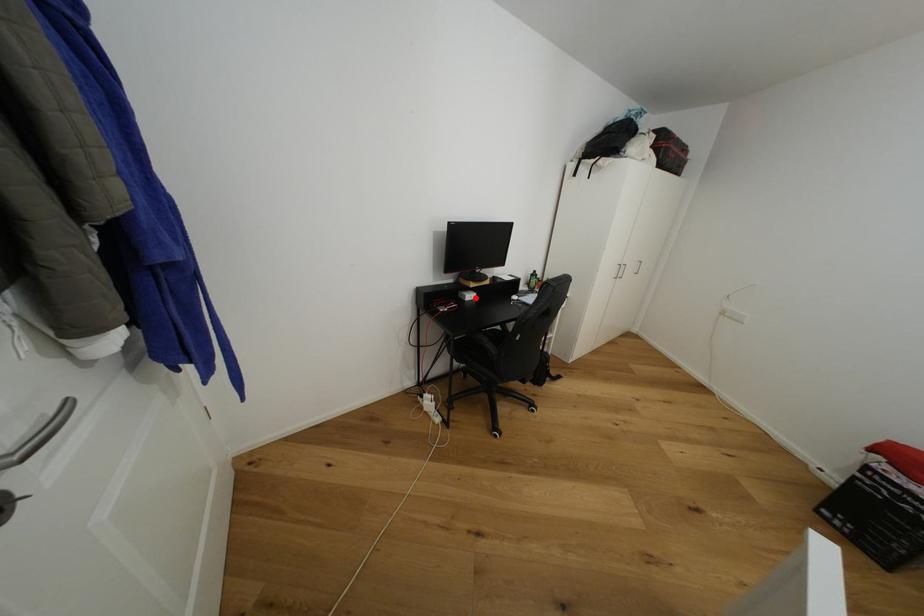
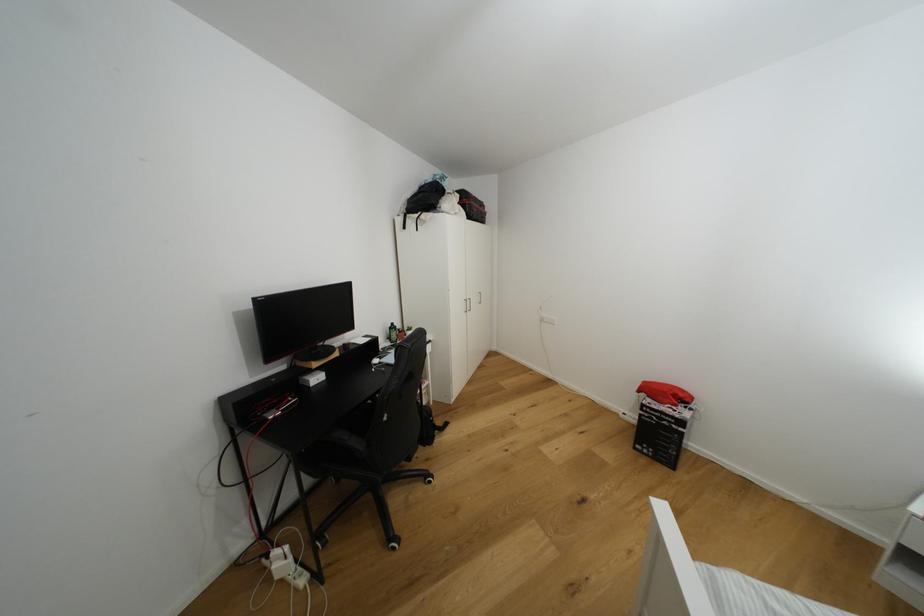
Question: I am providing you with two images of the same scene from different viewpoints. Given a red point in image1, look at the same physical point in image2. Is it:

Choices:
 (A) Closer to the viewpoint
 (B) Farther from the viewpoint

Answer: (B)